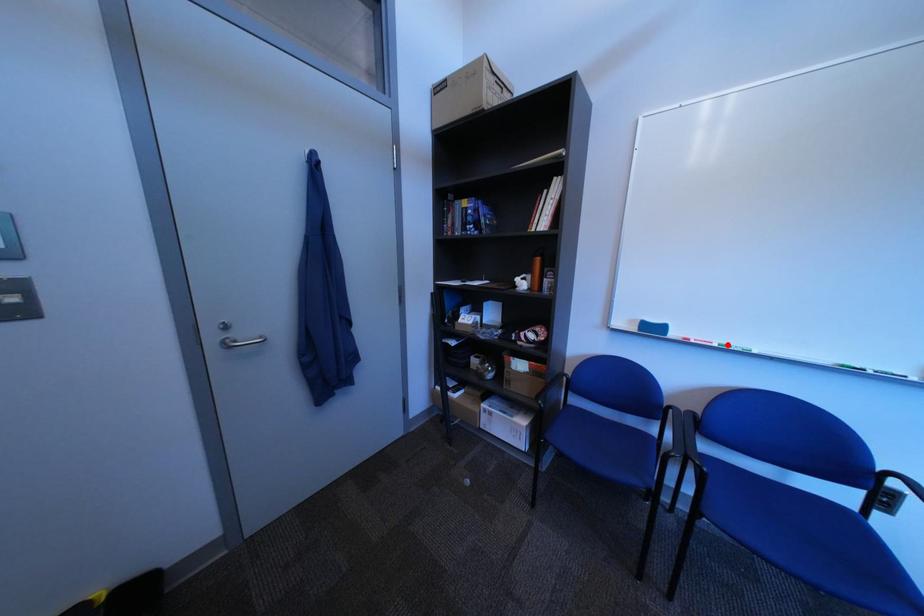
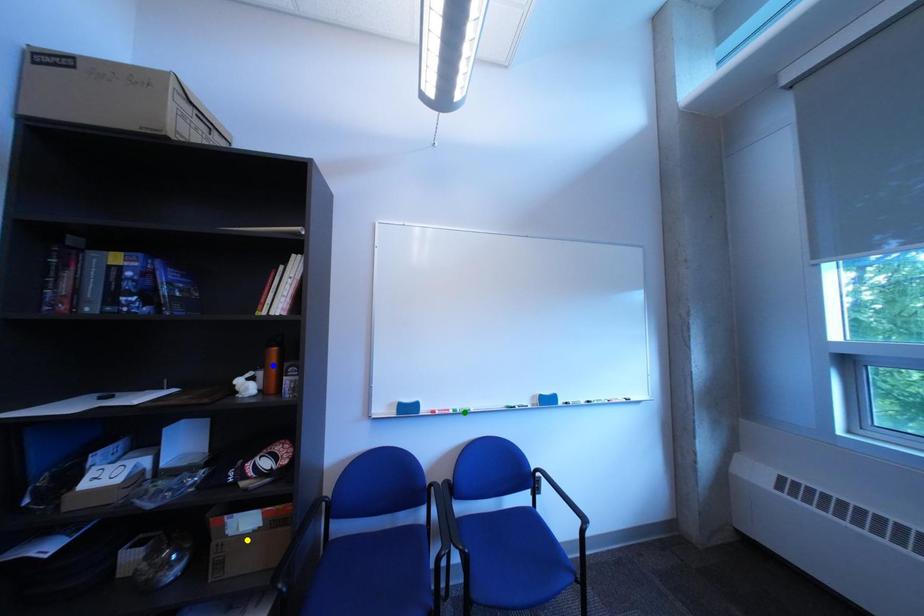
Question: I am providing you with two images of the same scene from different viewpoints. A red point is marked on the first image. You are given multiple points on the second image. Which point in image 2 represents the same 3d spot as the red point in image 1?

Choices:
 (A) yellow point
 (B) blue point
 (C) green point

Answer: (C)